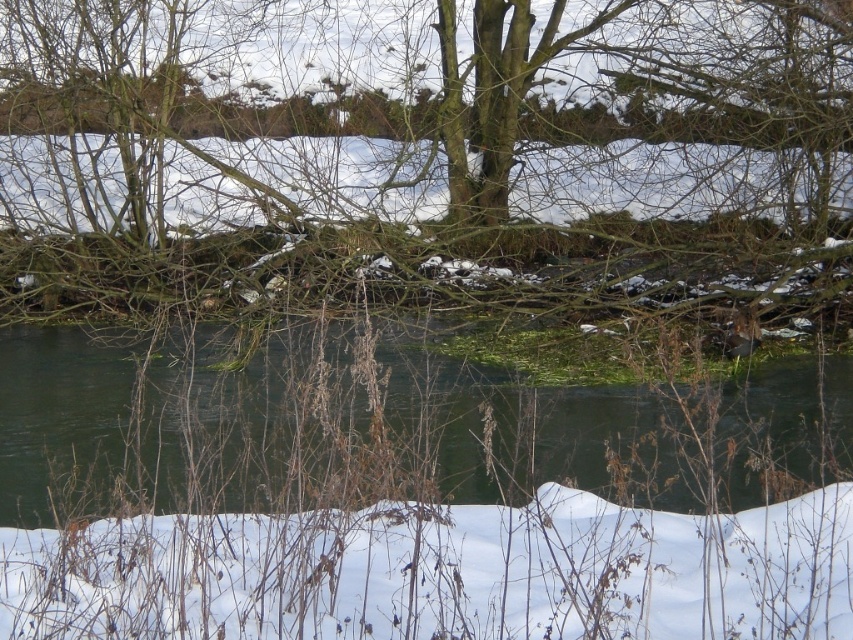
Can you confirm if brown bark tree at center is taller than white fluffy snow at lower center?

Correct, brown bark tree at center is much taller as white fluffy snow at lower center.

This screenshot has height=640, width=853. What do you see at coordinates (415, 148) in the screenshot?
I see `brown bark tree at center` at bounding box center [415, 148].

Which is behind, point (548, 100) or point (262, 557)?

The point (548, 100) is more distant.

This screenshot has height=640, width=853. I want to click on brown bark tree at center, so click(415, 148).

Who is more forward, [773,163] or [418,444]?

Positioned in front is point [418,444].

Which is behind, point (9, 168) or point (25, 332)?

Positioned behind is point (9, 168).

This screenshot has width=853, height=640. What do you see at coordinates (415, 148) in the screenshot?
I see `brown bark tree at center` at bounding box center [415, 148].

Find the location of a particular element. The width and height of the screenshot is (853, 640). brown bark tree at center is located at coordinates (415, 148).

Is green algae at center closer to camera compared to white fluffy snow at lower center?

No.

Locate an element on the screen. This screenshot has width=853, height=640. green algae at center is located at coordinates [386, 426].